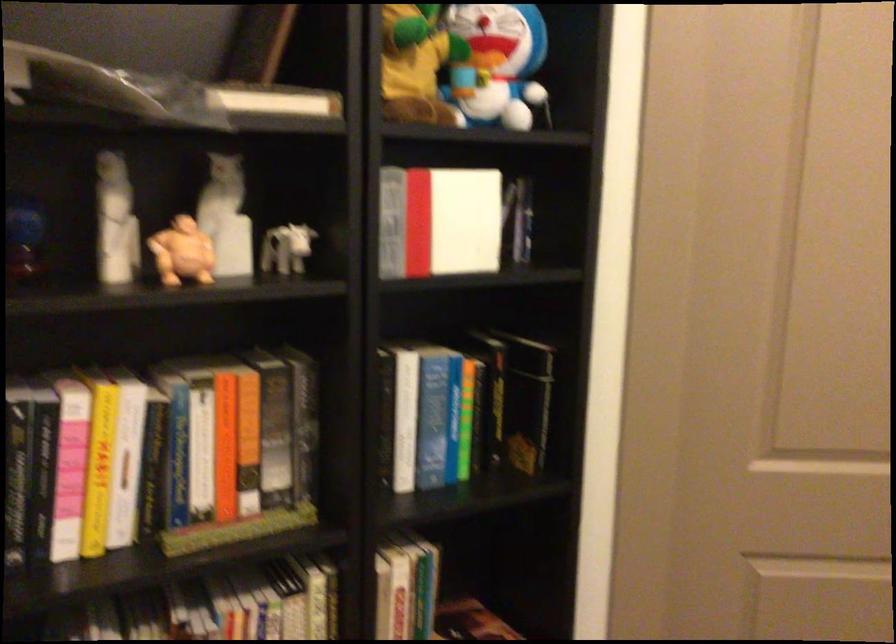
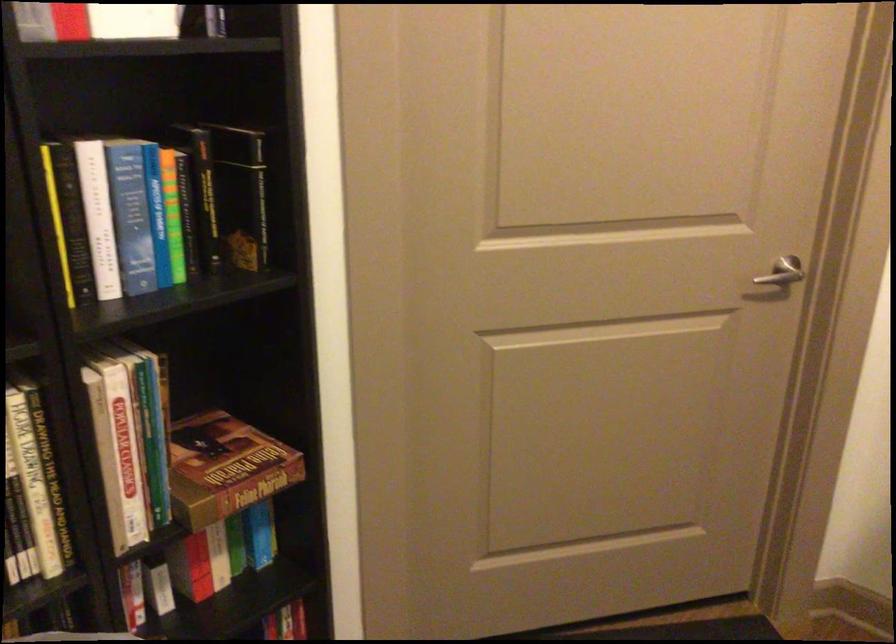
Find the pixel in the second image that matches (530,398) in the first image.

(240, 194)